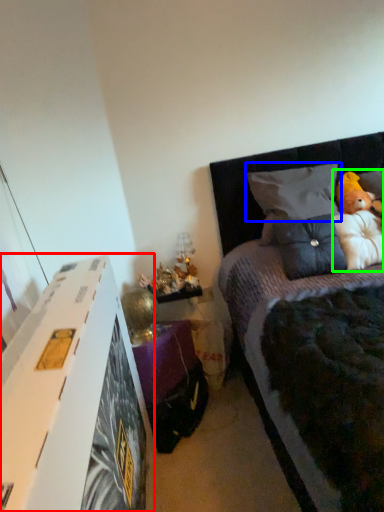
Question: Which object is the farthest from nightstand (highlighted by a red box)? Choose among these: pillow (highlighted by a blue box) or doll (highlighted by a green box).

Choices:
 (A) pillow
 (B) doll

Answer: (B)